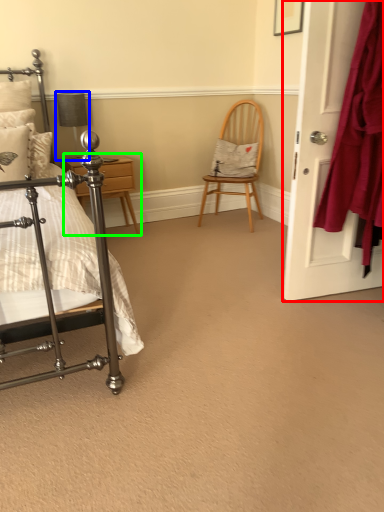
Question: Based on their relative distances, which object is nearer to door (highlighted by a red box)? Choose from table lamp (highlighted by a blue box) and nightstand (highlighted by a green box).

Choices:
 (A) table lamp
 (B) nightstand

Answer: (B)